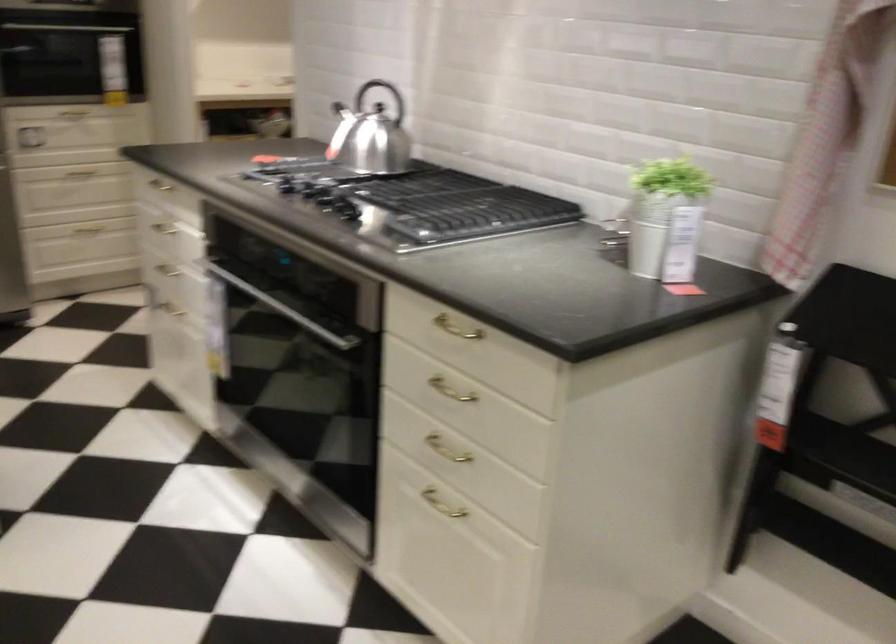
Find where to sit the chair sitting surface. Please return your answer as a coordinate pair (x, y).

(859, 500)